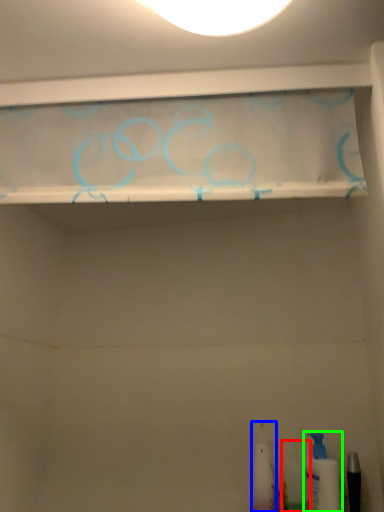
Question: Which object is positioned farthest from toiletry (highlighted by a red box)? Select from toiletry (highlighted by a blue box) and toiletry (highlighted by a green box).

Choices:
 (A) toiletry
 (B) toiletry

Answer: (A)